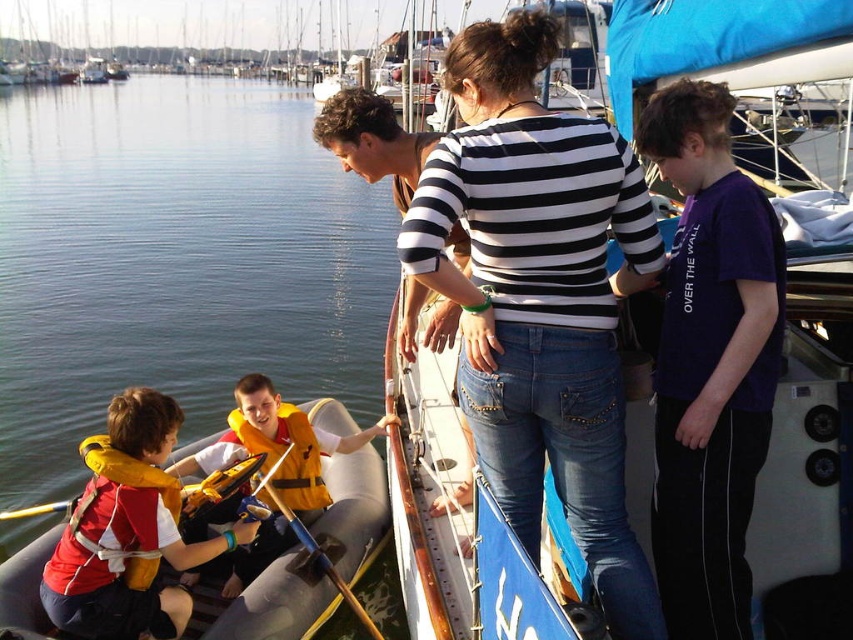
Can you confirm if black and white striped shirt at center is taller than yellow life vest at left?

Correct, black and white striped shirt at center is much taller as yellow life vest at left.

Which is in front, point (474, 400) or point (16, 509)?

Positioned in front is point (474, 400).

This screenshot has height=640, width=853. What are the coordinates of `black and white striped shirt at center` in the screenshot? It's located at (540, 298).

From the picture: Is black and white striped shirt at center smaller than yellow life jacket at lower left?

Incorrect, black and white striped shirt at center is not smaller in size than yellow life jacket at lower left.

Is black and white striped shirt at center shorter than yellow life jacket at lower left?

In fact, black and white striped shirt at center may be taller than yellow life jacket at lower left.

Does point (453, 176) come behind point (111, 461)?

No, it is not.

The width and height of the screenshot is (853, 640). Identify the location of black and white striped shirt at center. (540, 298).

Is the position of black and white striped shirt at center more distant than that of purple cotton shirt at upper right?

No.

Does black and white striped shirt at center have a lesser height compared to purple cotton shirt at upper right?

In fact, black and white striped shirt at center may be taller than purple cotton shirt at upper right.

Where is `black and white striped shirt at center`? The image size is (853, 640). black and white striped shirt at center is located at coordinates pyautogui.click(x=540, y=298).

Where is `black and white striped shirt at center`? The width and height of the screenshot is (853, 640). black and white striped shirt at center is located at coordinates (540, 298).